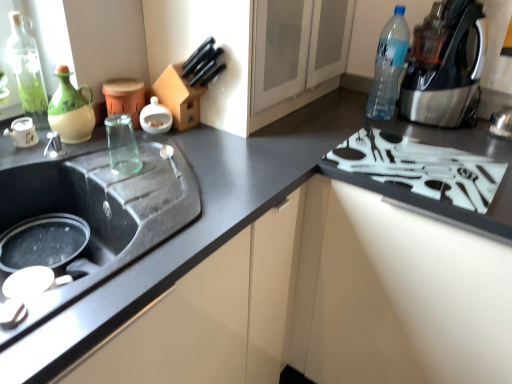
You are a GUI agent. You are given a task and a screenshot of the screen. Output one action in this format:
    pyautogui.click(x=<x>, y=<y>)
    Task: Click on the vacant area that is in front of transparent glass cup at sink
    
    Given the screenshot: What is the action you would take?
    pyautogui.click(x=140, y=197)